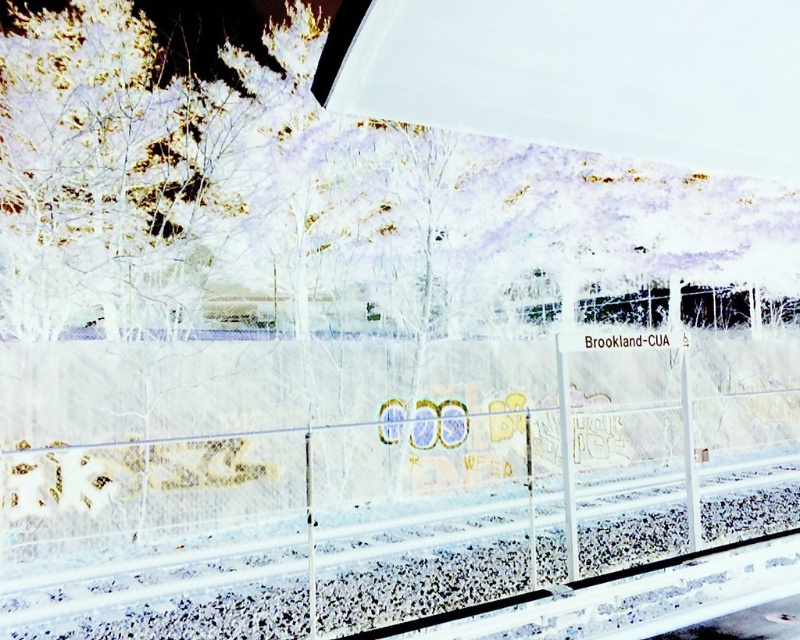
Is point (437, 36) positioned before point (368, 589)?

That is True.

Which is behind, point (406, 26) or point (316, 563)?

The point (316, 563) is behind.

Locate an element on the screen. white matte canopy at upper center is located at coordinates (582, 74).